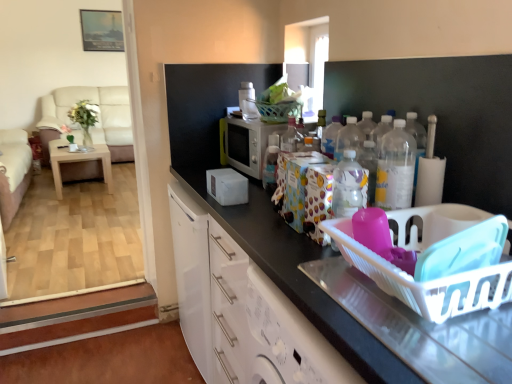
Locate an element on the screen. Image resolution: width=512 pixels, height=384 pixels. white glossy cabinet at center is located at coordinates (241, 311).

Measure the distance between beige fabric couch at left, the second couch positioned from the front, and camera.

beige fabric couch at left, the second couch positioned from the front, is 4.72 meters from camera.

What do you see at coordinates (249, 144) in the screenshot? This screenshot has height=384, width=512. I see `silver metallic microwave at center, the second appliance when ordered from top to bottom` at bounding box center [249, 144].

Measure the distance between clear plastic bottles at center-right and camera.

The depth of clear plastic bottles at center-right is 1.15 meters.

The width and height of the screenshot is (512, 384). What do you see at coordinates (13, 172) in the screenshot?
I see `beige fabric couch at left, which is the second couch in back-to-front order` at bounding box center [13, 172].

How much space does beige fabric couch at left, arranged as the first couch when viewed from the front, occupy vertically?

beige fabric couch at left, arranged as the first couch when viewed from the front, is 30.97 inches tall.

Measure the distance between point (x=89, y=158) and camera.

The distance of point (x=89, y=158) from camera is 15.52 feet.

Identify the location of white glossy microwave at center, the second appliance when ordered from bottom to top. (248, 101).

The width and height of the screenshot is (512, 384). Identify the location of white glossy cabinet at center. (241, 311).

Where is `screen door lying above the silver metallic microwave at center, the second appliance when ordered from top to bottom (from the image's perspective)`? This screenshot has height=384, width=512. screen door lying above the silver metallic microwave at center, the second appliance when ordered from top to bottom (from the image's perspective) is located at coordinates (309, 57).

From the picture: Is transparent glass screen door at upper center placed right next to silver metallic microwave at center, which ranks as the 1th appliance in bottom-to-top order?

There is a gap between transparent glass screen door at upper center and silver metallic microwave at center, which ranks as the 1th appliance in bottom-to-top order.

How many degrees apart are the facing directions of transparent glass screen door at upper center and silver metallic microwave at center, the second appliance when ordered from top to bottom?

They differ by 1.59 degrees in their facing directions.

Considering the relative sizes of transparent glass screen door at upper center and silver metallic microwave at center, which ranks as the 1th appliance in bottom-to-top order, in the image provided, is transparent glass screen door at upper center taller than silver metallic microwave at center, which ranks as the 1th appliance in bottom-to-top order,?

Indeed, transparent glass screen door at upper center has a greater height compared to silver metallic microwave at center, which ranks as the 1th appliance in bottom-to-top order.

From a real-world perspective, count 2nd appliances upward from the white glossy cabinet at center and point to it. Please provide its 2D coordinates.

[(248, 101)]

Consider the image. Can you confirm if white glossy microwave at center, the 1th appliance from the top, is taller than white glossy cabinet at center?

No.

Can you confirm if white glossy microwave at center, the second appliance when ordered from bottom to top, is thinner than white glossy cabinet at center?

Yes, white glossy microwave at center, the second appliance when ordered from bottom to top, is thinner than white glossy cabinet at center.

Is white glossy microwave at center, the 1th appliance from the top, in contact with white glossy cabinet at center?

white glossy microwave at center, the 1th appliance from the top, is not next to white glossy cabinet at center, and they're not touching.

From the image's perspective, is light brown wooden table at left located above or below clear plastic bottles at center-right?

Answer: Clearly, from the image's perspective, light brown wooden table at left is above clear plastic bottles at center-right.

Are light brown wooden table at left and clear plastic bottles at center-right located far from each other?

Absolutely, light brown wooden table at left is distant from clear plastic bottles at center-right.

Between light brown wooden table at left and clear plastic bottles at center-right, which one has more height?

Standing taller between the two is light brown wooden table at left.

Based on their sizes in the image, would you say light brown wooden table at left is bigger or smaller than clear plastic bottles at center-right?

light brown wooden table at left is bigger than clear plastic bottles at center-right.

From the image's perspective, is white glossy cabinet at center located above or below beige fabric couch at left, the second couch positioned from the front?

From the image's perspective, white glossy cabinet at center appears below beige fabric couch at left, the second couch positioned from the front.

Does point (182, 258) lie in front of point (42, 97)?

Yes.

Is white glossy cabinet at center in front of or behind beige fabric couch at left, the second couch positioned from the front, in the image?

Visually, white glossy cabinet at center is located in front of beige fabric couch at left, the second couch positioned from the front.

In terms of width, does white glossy cabinet at center look wider or thinner when compared to beige fabric couch at left, the second couch positioned from the front?

In the image, white glossy cabinet at center appears to be more narrow than beige fabric couch at left, the second couch positioned from the front.

Which of these two, white glossy microwave at center, the second appliance when ordered from bottom to top, or beige fabric couch at left, which is the second couch in back-to-front order, is smaller?

white glossy microwave at center, the second appliance when ordered from bottom to top.

Is white glossy microwave at center, the 1th appliance from the top, not close to beige fabric couch at left, arranged as the first couch when viewed from the front?

white glossy microwave at center, the 1th appliance from the top, is positioned a significant distance from beige fabric couch at left, arranged as the first couch when viewed from the front.

Is white glossy microwave at center, the 1th appliance from the top, behind beige fabric couch at left, arranged as the first couch when viewed from the front?

No, white glossy microwave at center, the 1th appliance from the top, is closer to the camera.

Is white glossy microwave at center, the 1th appliance from the top, to the right of beige fabric couch at left, which is the second couch in back-to-front order, from the viewer's perspective?

Correct, you'll find white glossy microwave at center, the 1th appliance from the top, to the right of beige fabric couch at left, which is the second couch in back-to-front order.

Measure the distance between white glossy cabinet at center and silver metallic microwave at center, which ranks as the 1th appliance in bottom-to-top order.

They are 20.48 inches apart.

Who is taller, white glossy cabinet at center or silver metallic microwave at center, the second appliance when ordered from top to bottom?

white glossy cabinet at center.

Can you confirm if white glossy cabinet at center is smaller than silver metallic microwave at center, which ranks as the 1th appliance in bottom-to-top order?

No, white glossy cabinet at center is not smaller than silver metallic microwave at center, which ranks as the 1th appliance in bottom-to-top order.

Considering their positions, is white glossy cabinet at center located in front of or behind silver metallic microwave at center, which ranks as the 1th appliance in bottom-to-top order?

white glossy cabinet at center is in front of silver metallic microwave at center, which ranks as the 1th appliance in bottom-to-top order.

Is clear plastic bottles at center-right smaller than light brown wooden table at left?

Correct, clear plastic bottles at center-right occupies less space than light brown wooden table at left.

Is clear plastic bottles at center-right aimed at light brown wooden table at left?

No.

Is clear plastic bottles at center-right inside the boundaries of light brown wooden table at left, or outside?

clear plastic bottles at center-right is located beyond the bounds of light brown wooden table at left.

Identify the location of screen door above the silver metallic microwave at center, the second appliance when ordered from top to bottom (from the image's perspective). The width and height of the screenshot is (512, 384). (309, 57).

Where is `appliance that is the 2nd one when counting backward from the white glossy cabinet at center`? appliance that is the 2nd one when counting backward from the white glossy cabinet at center is located at coordinates (248, 101).

Considering their positions, is transparent glass screen door at upper center positioned closer to beige fabric couch at left, which is the second couch in back-to-front order, than clear plastic bottles at center-right?

transparent glass screen door at upper center is closer to beige fabric couch at left, which is the second couch in back-to-front order.

Estimate the real-world distances between objects in this image. Which object is further from silver metallic microwave at center, which ranks as the 1th appliance in bottom-to-top order, beige fabric couch at left, arranged as the first couch when viewed from the back, or clear plastic bottles at center-right?

beige fabric couch at left, arranged as the first couch when viewed from the back, is positioned further to the anchor silver metallic microwave at center, which ranks as the 1th appliance in bottom-to-top order.

Based on their spatial positions, is white plastic basket at right or white glossy microwave at center, the 1th appliance from the top, further from white glossy cabinet at center?

Based on the image, white glossy microwave at center, the 1th appliance from the top, appears to be further to white glossy cabinet at center.

From the image, which object appears to be farther from light brown wooden table at left, clear plastic bottles at center-right or white plastic basket at right?

The object further to light brown wooden table at left is white plastic basket at right.

Looking at the image, which one is located closer to clear plastic bottles at center-right, transparent glass screen door at upper center or light brown wooden table at left?

transparent glass screen door at upper center.

Looking at the image, which one is located further to clear plastic bottles at center-right, light brown wooden table at left or transparent glass screen door at upper center?

light brown wooden table at left is further to clear plastic bottles at center-right.

Which object lies nearer to the anchor point transparent glass screen door at upper center, beige fabric couch at left, arranged as the first couch when viewed from the front, or clear plastic bottles at center-right?

Based on the image, clear plastic bottles at center-right appears to be nearer to transparent glass screen door at upper center.

When comparing their distances from beige fabric couch at left, the second couch positioned from the front, does light brown wooden table at left or clear plastic bottles at center-right seem further?

Among the two, clear plastic bottles at center-right is located further to beige fabric couch at left, the second couch positioned from the front.

Locate an element on the screen. The image size is (512, 384). appliance situated between beige fabric couch at left, arranged as the first couch when viewed from the front, and silver metallic microwave at center, which ranks as the 1th appliance in bottom-to-top order, from left to right is located at coordinates (248, 101).

I want to click on bottle between white plastic basket at right and silver metallic microwave at center, which ranks as the 1th appliance in bottom-to-top order, from front to back, so click(395, 168).

Find the location of a particular element. This screenshot has height=384, width=512. appliance positioned between clear plastic bottles at center-right and white glossy microwave at center, the 1th appliance from the top, from near to far is located at coordinates (249, 144).

You are a GUI agent. You are given a task and a screenshot of the screen. Output one action in this format:
    pyautogui.click(x=<x>, y=<y>)
    Task: Click on the cabinetry between white plastic basket at right and beige fabric couch at left, the second couch positioned from the front, from front to back
    This screenshot has height=384, width=512.
    Given the screenshot: What is the action you would take?
    pyautogui.click(x=241, y=311)